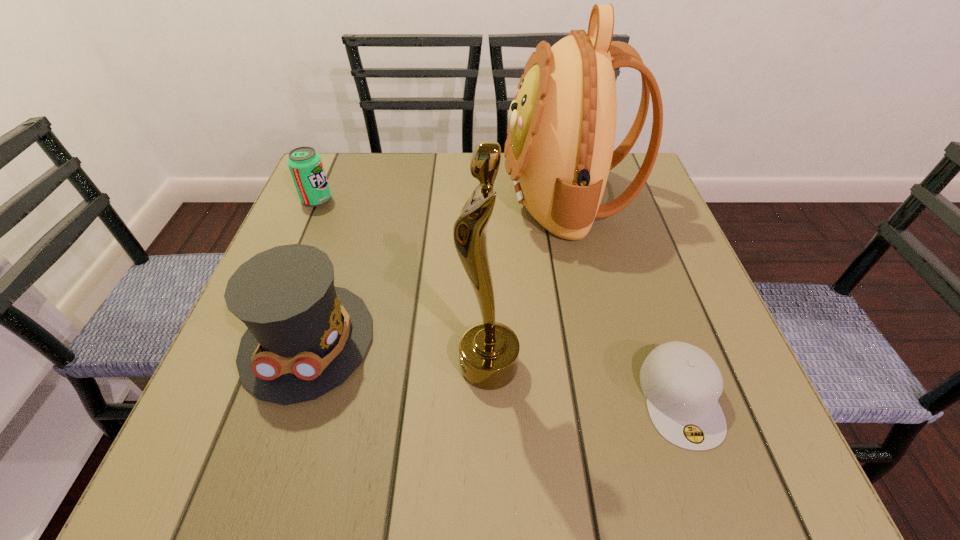
Find the location of a particular element. This screenshot has width=960, height=540. backpack is located at coordinates (561, 132).

Find the location of a particular element. The height and width of the screenshot is (540, 960). award is located at coordinates coord(488,351).

Identify the location of the third tallest object. (305, 337).

You are a GUI agent. You are given a task and a screenshot of the screen. Output one action in this format:
    pyautogui.click(x=<x>, y=<y>)
    Task: Click on the pop soda
    
    Given the screenshot: What is the action you would take?
    pyautogui.click(x=305, y=165)

Where is `the shortest object`? The image size is (960, 540). the shortest object is located at coordinates (682, 384).

Find the location of a particular element. This screenshot has height=540, width=960. free space located on the front-facing side of the backpack is located at coordinates (423, 199).

At what (x,y) coordinates should I click in order to perform the action: click on vacant area situated 0.170m on the front-facing side of the backpack. Please return your answer as a coordinate pair (x, y). The width and height of the screenshot is (960, 540). Looking at the image, I should click on (432, 199).

Find the location of a particular element. free space located on the front-facing side of the backpack is located at coordinates (386, 199).

At what (x,y) coordinates should I click in order to perform the action: click on vacant area situated 0.120m on the front-facing side of the award. Please return your answer as a coordinate pair (x, y). The width and height of the screenshot is (960, 540). Looking at the image, I should click on (x=387, y=367).

The width and height of the screenshot is (960, 540). Identify the location of free space located 0.210m on the front-facing side of the award. (333, 367).